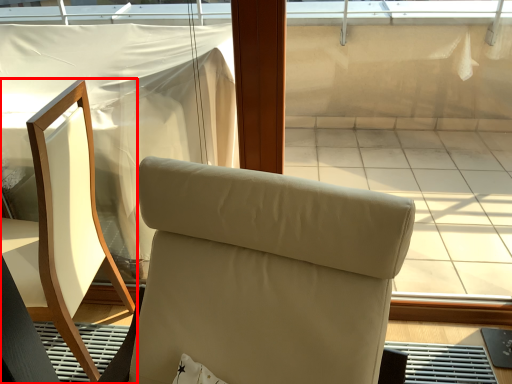
Question: From the image's perspective, considering the relative positions of chair (annotated by the red box) and chair in the image provided, where is chair (annotated by the red box) located with respect to the staircase?

Choices:
 (A) below
 (B) above

Answer: (B)